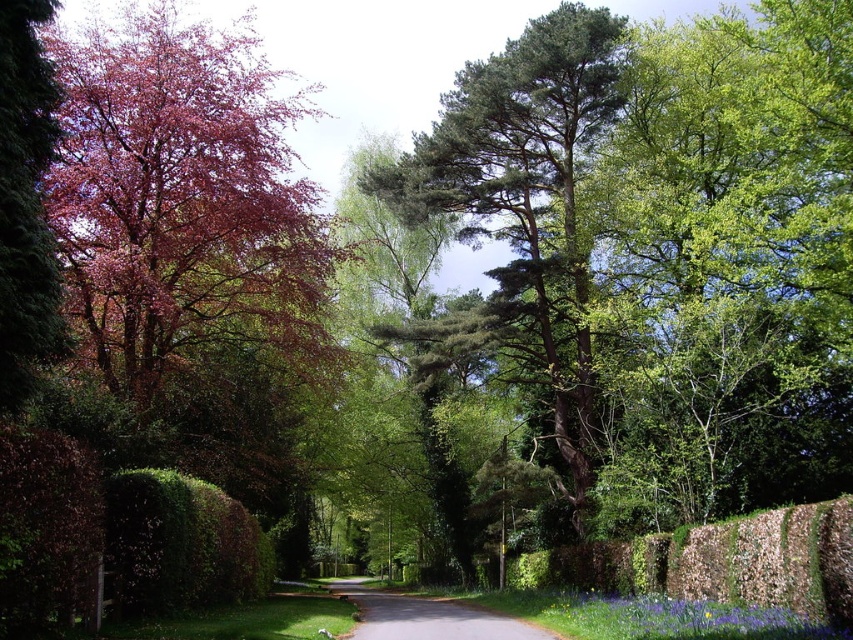
Question: Does green leafy hedge at lower right have a lesser width compared to green leafy hedge at lower left?

Choices:
 (A) no
 (B) yes

Answer: (A)

Question: Which point is closer to the camera taking this photo?

Choices:
 (A) (465, 621)
 (B) (134, 592)
 (C) (798, 515)
 (D) (583, 426)

Answer: (C)

Question: Is green textured tree at center above gray asphalt road at center?

Choices:
 (A) yes
 (B) no

Answer: (A)

Question: Which object is closer to the camera taking this photo?

Choices:
 (A) green leafy hedge at lower left
 (B) green textured tree at center
 (C) gray asphalt road at center

Answer: (A)

Question: Considering the relative positions of green leafy hedge at lower right and green leafy hedge at lower left in the image provided, where is green leafy hedge at lower right located with respect to green leafy hedge at lower left?

Choices:
 (A) below
 (B) above

Answer: (A)

Question: Among these points, which one is farthest from the camera?

Choices:
 (A) (419, 620)
 (B) (579, 106)
 (C) (697, 593)

Answer: (B)